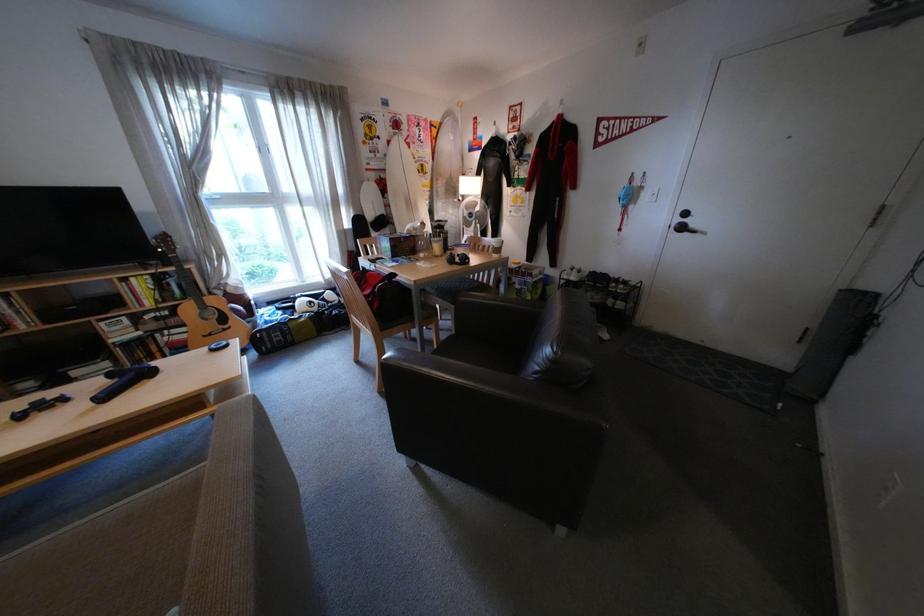
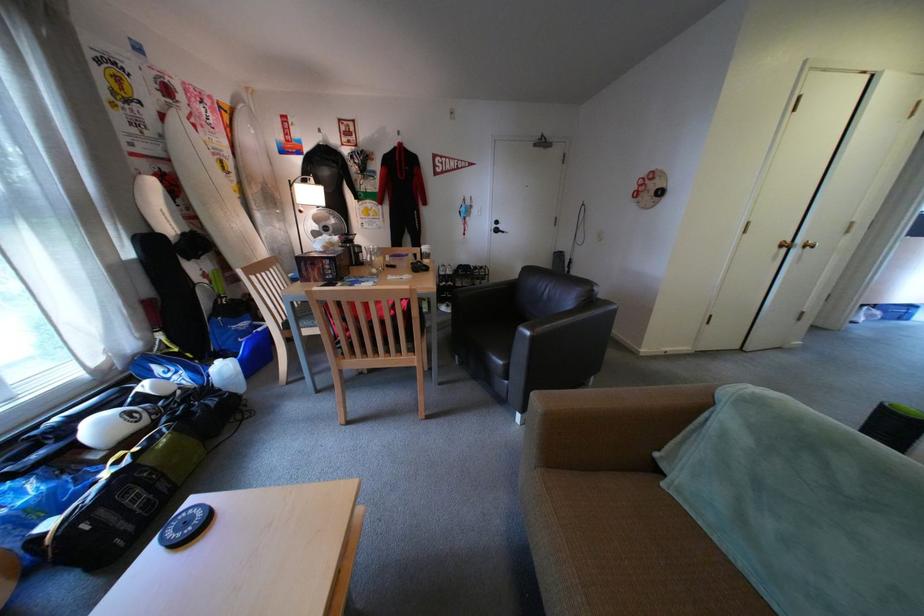
The point at (631, 302) is marked in the first image. Where is the corresponding point in the second image?

(496, 282)